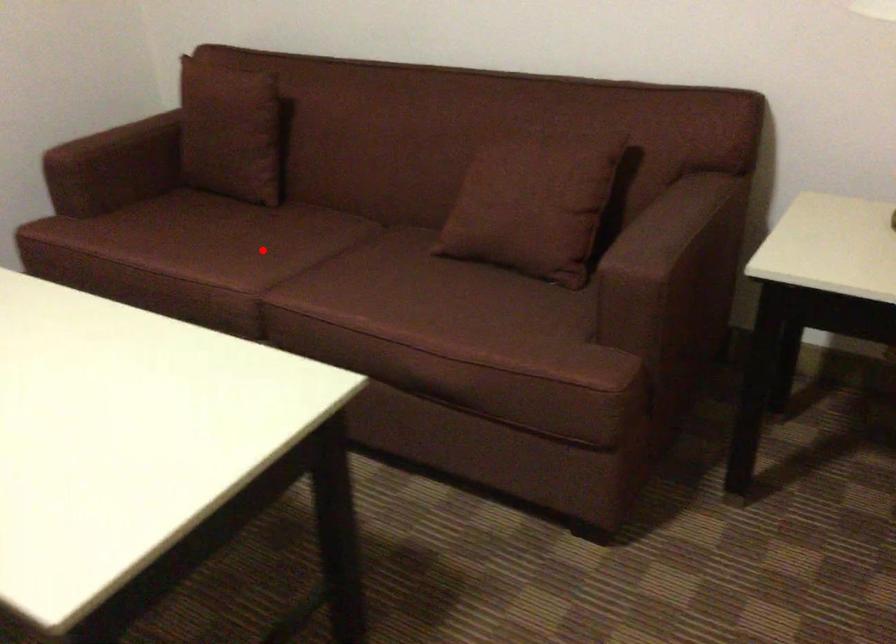
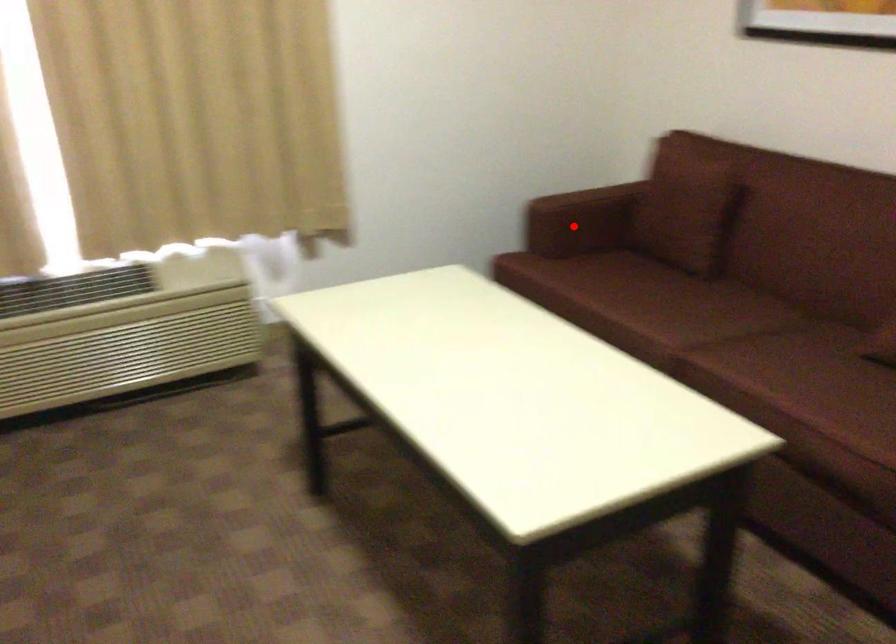
I am providing you with two images of the same scene from different viewpoints. A red point is marked on the first image and another point is marked on the second image. Is the red point in image1 aligned with the point shown in image2?

No